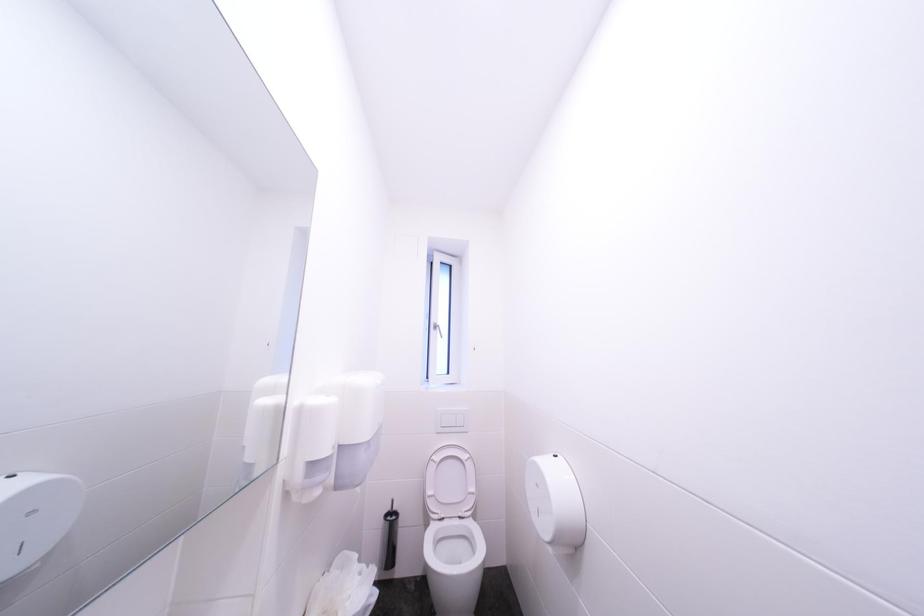
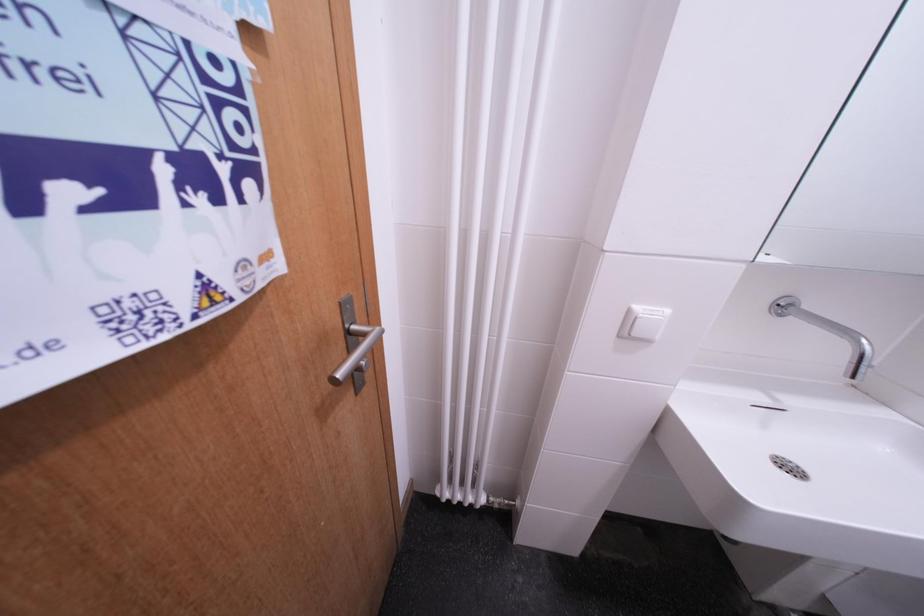
First-person continuous shooting, in which direction is the camera rotating?

The camera's rotation is toward left-down.